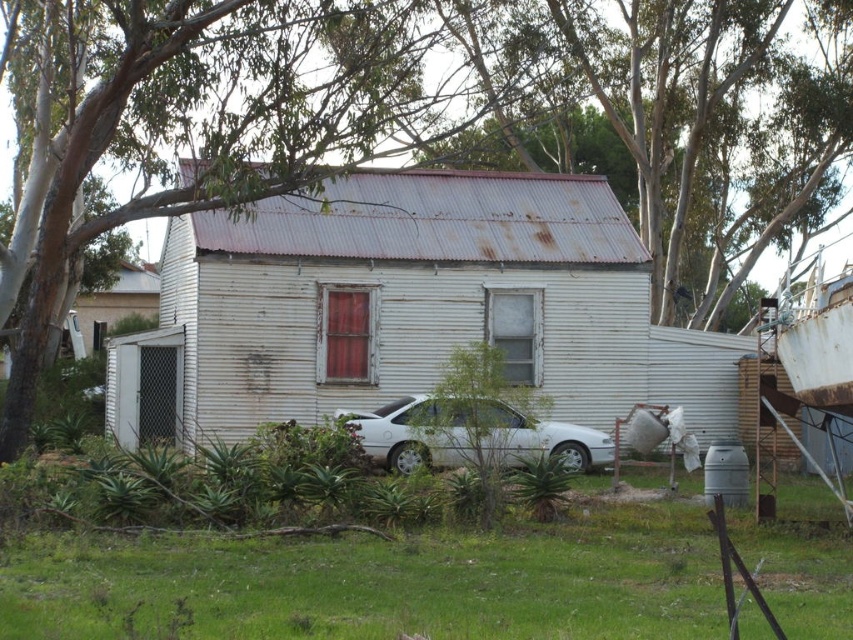
Is green grass at lower center to the right of green leafy tree at upper center from the viewer's perspective?

Indeed, green grass at lower center is positioned on the right side of green leafy tree at upper center.

Is point (53, 588) closer to camera compared to point (19, 228)?

Yes.

Image resolution: width=853 pixels, height=640 pixels. Identify the location of green grass at lower center. (379, 582).

The width and height of the screenshot is (853, 640). In order to click on green grass at lower center in this screenshot , I will do `click(379, 582)`.

Measure the distance between rusty metal roof at upper center and camera.

rusty metal roof at upper center is 22.43 meters from camera.

Does rusty metal roof at upper center come behind white matte car at center?

Yes.

Image resolution: width=853 pixels, height=640 pixels. Identify the location of rusty metal roof at upper center. (677, 120).

Is green leafy tree at upper center further to the viewer compared to white matte car at center?

Yes, it is behind white matte car at center.

In the scene shown: Does green leafy tree at upper center have a greater height compared to white matte car at center?

Yes.

Find the location of a particular element. This screenshot has width=853, height=640. green leafy tree at upper center is located at coordinates (218, 125).

I want to click on green leafy tree at upper center, so click(218, 125).